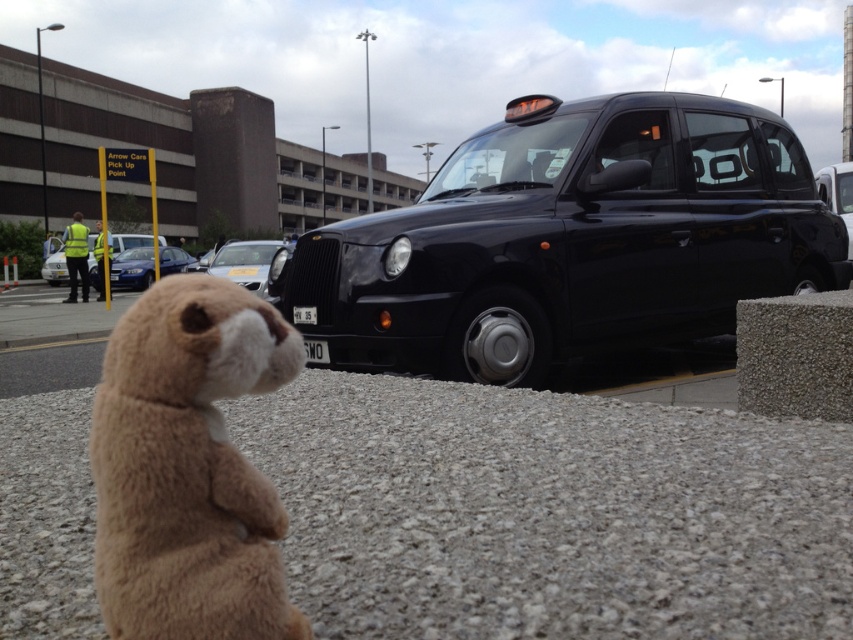
Which of these two, blue metallic sedan at center or silver metallic car at center, stands shorter?

silver metallic car at center is shorter.

Is blue metallic sedan at center positioned behind silver metallic car at center?

Yes, it is.

The height and width of the screenshot is (640, 853). I want to click on blue metallic sedan at center, so click(132, 268).

Is brown plush toy at lower left smaller than blue metallic sedan at center?

Correct, brown plush toy at lower left occupies less space than blue metallic sedan at center.

Based on the photo, does brown plush toy at lower left have a larger size compared to blue metallic sedan at center?

No.

I want to click on brown plush toy at lower left, so click(x=189, y=468).

Is shiny black taxi at center above brown plush toy at lower left?

Correct, shiny black taxi at center is located above brown plush toy at lower left.

Describe the element at coordinates (569, 241) in the screenshot. I see `shiny black taxi at center` at that location.

Does point (364, 227) come in front of point (213, 348)?

That is False.

The width and height of the screenshot is (853, 640). I want to click on shiny black taxi at center, so click(x=569, y=241).